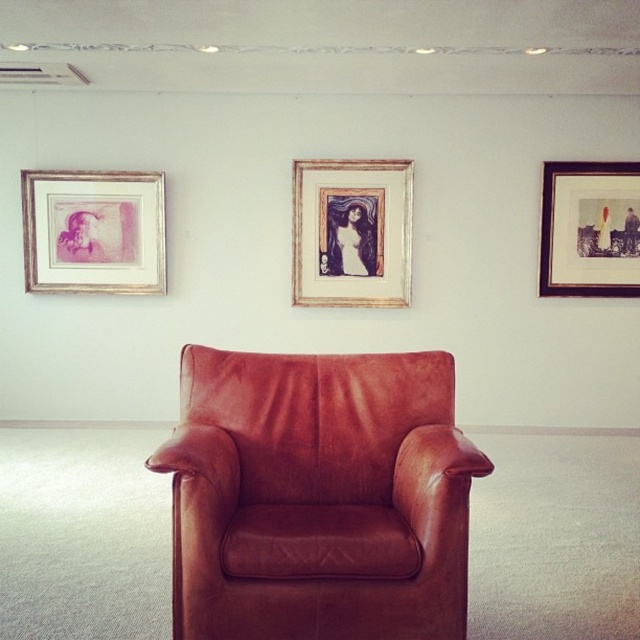
Question: Does brown leather armchair at center have a smaller size compared to matte pink paper at left?

Choices:
 (A) no
 (B) yes

Answer: (A)

Question: Is brown leather armchair at center above matte pink paper at left?

Choices:
 (A) no
 (B) yes

Answer: (A)

Question: Which object is farther from the camera taking this photo?

Choices:
 (A) matte pink paper at left
 (B) wooden frame at center
 (C) wooden picture frame at upper right
 (D) brown leather armchair at center

Answer: (B)

Question: Does wooden frame at center appear on the right side of wooden picture frame at upper right?

Choices:
 (A) no
 (B) yes

Answer: (A)

Question: Which point is farther from the camera taking this photo?

Choices:
 (A) (122, 216)
 (B) (432, 529)
 (C) (410, 204)
 (D) (579, 269)

Answer: (D)

Question: Estimate the real-world distances between objects in this image. Which object is farther from the matte pink paper at left?

Choices:
 (A) wooden frame at center
 (B) brown leather armchair at center

Answer: (B)